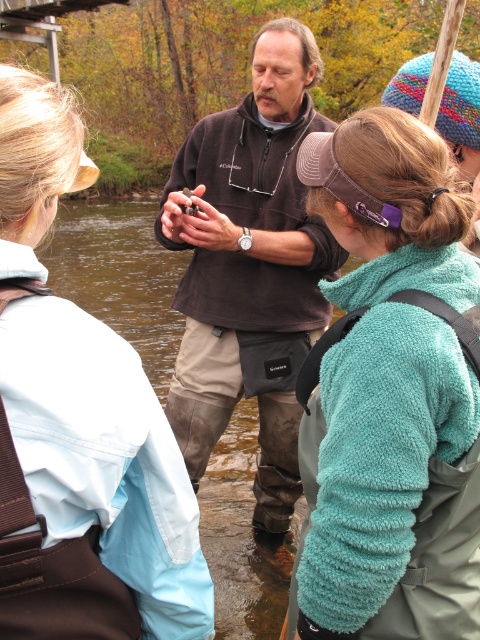
You are a photographer trying to capture a photo of the light blue waterproof jacket at upper left and the brown soft sweater at center. Since you want both items to appear equally prominent in the photo, which jacket should you zoom in on more?

The light blue waterproof jacket at upper left is shorter than the brown soft sweater at center, so you should zoom in more on the light blue waterproof jacket at upper left to make it appear larger and balance its prominence with the taller brown soft sweater at center.

Based on the scene description, which object is positioned lower in the image? Please refer to the spatial relationship between the light blue waterproof jacket at upper left and the brown soft sweater at center.

The light blue waterproof jacket at upper left is located below the brown soft sweater at center, meaning it is positioned lower in the image.

You are organizing a clothing display and need to arrange the light blue waterproof jacket at upper left and the brown soft sweater at center based on their widths. Which one should you place on the narrower rack?

The light blue waterproof jacket at upper left should be placed on the narrower rack because its width is less than the brown soft sweater at center.